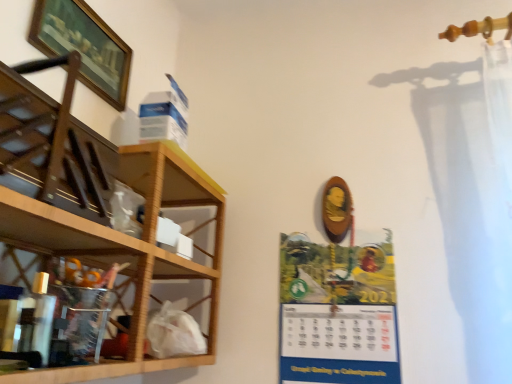
In order to face translucent plastic cabinet at left, should I rotate leftwards or rightwards?

You should look left and rotate roughly 24.712 degrees.

Measure the distance between wooden framed picture at upper left and camera.

A distance of 33.27 inches exists between wooden framed picture at upper left and camera.

What do you see at coordinates (84, 46) in the screenshot? This screenshot has width=512, height=384. I see `wooden framed picture at upper left` at bounding box center [84, 46].

The image size is (512, 384). What do you see at coordinates (99, 215) in the screenshot? I see `wooden at left` at bounding box center [99, 215].

You are a GUI agent. You are given a task and a screenshot of the screen. Output one action in this format:
    pyautogui.click(x=<x>, y=<y>)
    Task: Click on the translucent plastic cabinet at left
    The image size is (512, 384).
    Given the screenshot: What is the action you would take?
    pyautogui.click(x=50, y=315)

Can you confirm if translucent plastic cabinet at left is thinner than matte paper calendar at center-right?

Incorrect, the width of translucent plastic cabinet at left is not less than that of matte paper calendar at center-right.

Does point (89, 353) come closer to viewer compared to point (369, 349)?

Yes, it is in front of point (369, 349).

Can you tell me how much translucent plastic cabinet at left and matte paper calendar at center-right differ in facing direction?

The angle between the facing direction of translucent plastic cabinet at left and the facing direction of matte paper calendar at center-right is 88.7 degrees.

There is a matte paper calendar at center-right. In order to click on shelf above it (from a real-world perspective) in this screenshot , I will do `click(99, 215)`.

Is wooden at left directly adjacent to matte paper calendar at center-right?

wooden at left is not next to matte paper calendar at center-right, and they're not touching.

Considering the points (217, 192) and (288, 332), which point is behind, point (217, 192) or point (288, 332)?

The point (217, 192) is more distant.

Is wooden at left facing towards matte paper calendar at center-right?

Yes, wooden at left faces towards matte paper calendar at center-right.

Which object is positioned more to the right, wooden at left or wooden framed picture at upper left?

Positioned to the right is wooden at left.

Can we say wooden at left lies outside wooden framed picture at upper left?

wooden at left lies outside wooden framed picture at upper left's area.

Are wooden at left and wooden framed picture at upper left beside each other?

No, wooden at left is not beside wooden framed picture at upper left.

Considering the relative sizes of wooden framed picture at upper left and translucent plastic cabinet at left in the image provided, is wooden framed picture at upper left thinner than translucent plastic cabinet at left?

Yes.

Based on the photo, is wooden framed picture at upper left facing towards translucent plastic cabinet at left?

No, wooden framed picture at upper left is not aimed at translucent plastic cabinet at left.

Where is `cabinet to the right of wooden framed picture at upper left`? cabinet to the right of wooden framed picture at upper left is located at coordinates (50, 315).

Can translucent plastic cabinet at left be found inside wooden framed picture at upper left?

Definitely not — translucent plastic cabinet at left is not inside wooden framed picture at upper left.

Which is in front, point (59, 346) or point (50, 149)?

The point (50, 149) is more forward.

Considering the relative positions of translucent plastic cabinet at left and wooden at left in the image provided, is translucent plastic cabinet at left in front of wooden at left?

No, it is behind wooden at left.

From a real-world perspective, who is located lower, translucent plastic cabinet at left or wooden at left?

In real-world perspective, translucent plastic cabinet at left is lower.

Is matte paper calendar at center-right to the left or to the right of translucent plastic cabinet at left in the image?

matte paper calendar at center-right is positioned on translucent plastic cabinet at left's right side.

Could you tell me if matte paper calendar at center-right is turned towards translucent plastic cabinet at left?

No, matte paper calendar at center-right is not oriented towards translucent plastic cabinet at left.

Which object is closer to the camera, matte paper calendar at center-right or translucent plastic cabinet at left?

Positioned in front is translucent plastic cabinet at left.

Does matte paper calendar at center-right have a lesser height compared to translucent plastic cabinet at left?

In fact, matte paper calendar at center-right may be taller than translucent plastic cabinet at left.

Does translucent plastic cabinet at left turn towards wooden framed picture at upper left?

No, translucent plastic cabinet at left is not oriented towards wooden framed picture at upper left.

From a real-world perspective, which object stands above the other?

wooden framed picture at upper left, from a real-world perspective.

The height and width of the screenshot is (384, 512). Find the location of `picture frame that is on the left side of translucent plastic cabinet at left`. picture frame that is on the left side of translucent plastic cabinet at left is located at coordinates (84, 46).

Is translucent plastic cabinet at left thinner than wooden framed picture at upper left?

No, translucent plastic cabinet at left is not thinner than wooden framed picture at upper left.

Locate an element on the screen. poster page that is on the right side of translucent plastic cabinet at left is located at coordinates tap(337, 312).

Image resolution: width=512 pixels, height=384 pixels. Identify the location of shelf in front of the matte paper calendar at center-right. (99, 215).

Estimate the real-world distances between objects in this image. Which object is closer to wooden framed picture at upper left, matte paper calendar at center-right or translucent plastic cabinet at left?

translucent plastic cabinet at left is closer to wooden framed picture at upper left.

Looking at the image, which one is located further to wooden at left, wooden framed picture at upper left or translucent plastic cabinet at left?

wooden framed picture at upper left is positioned further to the anchor wooden at left.

When comparing their distances from translucent plastic cabinet at left, does wooden framed picture at upper left or matte paper calendar at center-right seem further?

matte paper calendar at center-right is positioned further to the anchor translucent plastic cabinet at left.

Based on their spatial positions, is translucent plastic cabinet at left or wooden framed picture at upper left closer to wooden at left?

translucent plastic cabinet at left.

Which object lies nearer to the anchor point wooden at left, matte paper calendar at center-right or translucent plastic cabinet at left?

The object closer to wooden at left is translucent plastic cabinet at left.

Looking at the image, which one is located further to wooden framed picture at upper left, matte paper calendar at center-right or wooden at left?

matte paper calendar at center-right.

Looking at this image, estimate the real-world distances between objects in this image. Which object is further from matte paper calendar at center-right, wooden at left or wooden framed picture at upper left?

wooden framed picture at upper left lies further to matte paper calendar at center-right than the other object.

When comparing their distances from wooden at left, does translucent plastic cabinet at left or matte paper calendar at center-right seem further?

matte paper calendar at center-right is further to wooden at left.

Locate an element on the screen. This screenshot has width=512, height=384. shelf between wooden framed picture at upper left and matte paper calendar at center-right from top to bottom is located at coordinates (99, 215).

The image size is (512, 384). In order to click on cabinet that lies between wooden framed picture at upper left and matte paper calendar at center-right from top to bottom in this screenshot , I will do pos(50,315).

Find the location of `shelf situated between translucent plastic cabinet at left and matte paper calendar at center-right from left to right`. shelf situated between translucent plastic cabinet at left and matte paper calendar at center-right from left to right is located at coordinates (99, 215).

Find the location of a particular element. shelf between wooden framed picture at upper left and translucent plastic cabinet at left vertically is located at coordinates (99, 215).